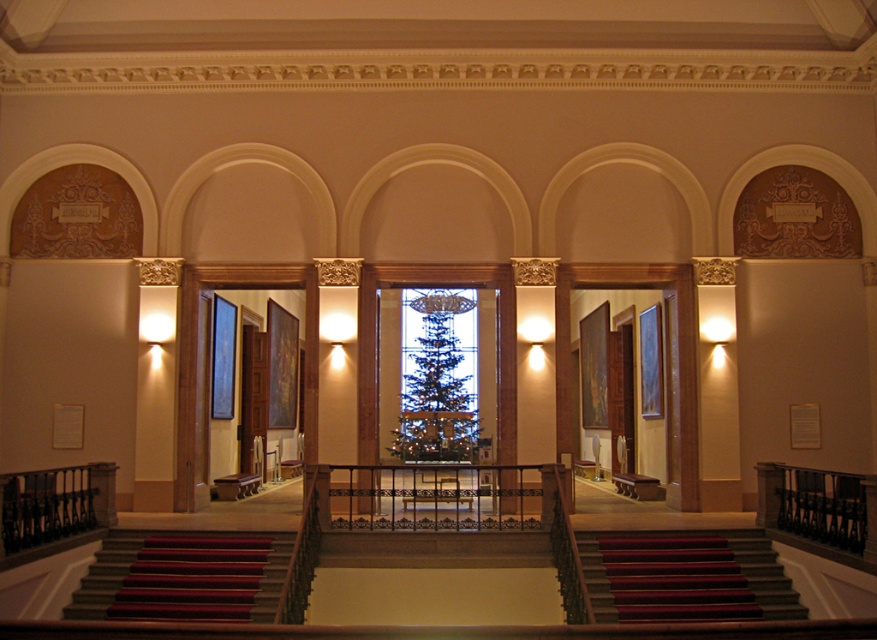
In the scene shown: You are an interior designer planning to place a large sculpture in this space. You need to choose between placing it on the dark gray carpeted stairs at center or the red carpeted stairs at lower left. Which location would allow the sculpture to occupy more space without overcrowding the area?

The dark gray carpeted stairs at center is bigger than the red carpeted stairs at lower left, so placing the sculpture on the dark gray carpeted stairs at center would allow it to occupy more space without overcrowding the area.

You are standing at the top of the staircase in the grand building and want to take a photo. There are two points marked in the scene, point [686,566] and point [455,307]. Which point will appear larger in your photo?

Point [686,566] is closer to the camera than point [455,307], so it will appear larger in the photo.